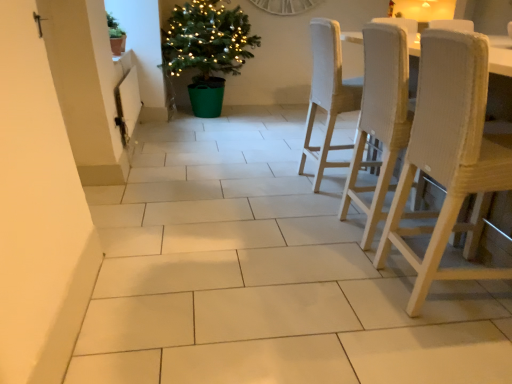
Question: Is the depth of green plastic potted plant at center-left, which appears as the 2th houseplant when viewed from the left, greater than that of matte brown pot at upper left?

Choices:
 (A) yes
 (B) no

Answer: (A)

Question: Can we say green plastic potted plant at center-left, which appears as the 2th houseplant when viewed from the left, lies outside matte brown pot at upper left?

Choices:
 (A) yes
 (B) no

Answer: (A)

Question: Does green plastic potted plant at center-left, the 1th houseplant in the back-to-front sequence, have a greater width compared to matte brown pot at upper left?

Choices:
 (A) yes
 (B) no

Answer: (A)

Question: Is green plastic potted plant at center-left, which appears as the 2th houseplant when viewed from the left, oriented towards matte brown pot at upper left?

Choices:
 (A) no
 (B) yes

Answer: (A)

Question: From a real-world perspective, is green plastic potted plant at center-left, which appears as the 2th houseplant when viewed from the front, over matte brown pot at upper left?

Choices:
 (A) no
 (B) yes

Answer: (A)

Question: Are green plastic potted plant at center-left, which appears as the 2th houseplant when viewed from the front, and matte brown pot at upper left beside each other?

Choices:
 (A) no
 (B) yes

Answer: (A)

Question: Are green plastic potted plant at center-left, which appears as the 2th houseplant when viewed from the left, and white textured wood chair at right, the third chair from the back, far apart?

Choices:
 (A) no
 (B) yes

Answer: (B)

Question: Does green plastic potted plant at center-left, which appears as the 2th houseplant when viewed from the front, contain white textured wood chair at right, the third chair from the back?

Choices:
 (A) no
 (B) yes

Answer: (A)

Question: From the image's perspective, would you say green plastic potted plant at center-left, the 1th houseplant in the back-to-front sequence, is shown under white textured wood chair at right, the third chair from the back?

Choices:
 (A) no
 (B) yes

Answer: (A)

Question: Considering the relative sizes of green plastic potted plant at center-left, the 1th houseplant in the back-to-front sequence, and white textured wood chair at right, the third chair from the back, in the image provided, is green plastic potted plant at center-left, the 1th houseplant in the back-to-front sequence, wider than white textured wood chair at right, the third chair from the back,?

Choices:
 (A) no
 (B) yes

Answer: (B)

Question: From a real-world perspective, is green plastic potted plant at center-left, which ranks as the first houseplant in right-to-left order, located beneath white textured wood chair at right, the third chair from the back?

Choices:
 (A) yes
 (B) no

Answer: (B)

Question: Is green plastic potted plant at center-left, which appears as the 2th houseplant when viewed from the front, at the left side of white textured wood chair at right, the third chair from the back?

Choices:
 (A) no
 (B) yes

Answer: (B)

Question: Is woven fabric chair at right, the 2th chair viewed from the front, looking in the opposite direction of white textured wood chair at right, the third chair from the back?

Choices:
 (A) no
 (B) yes

Answer: (A)